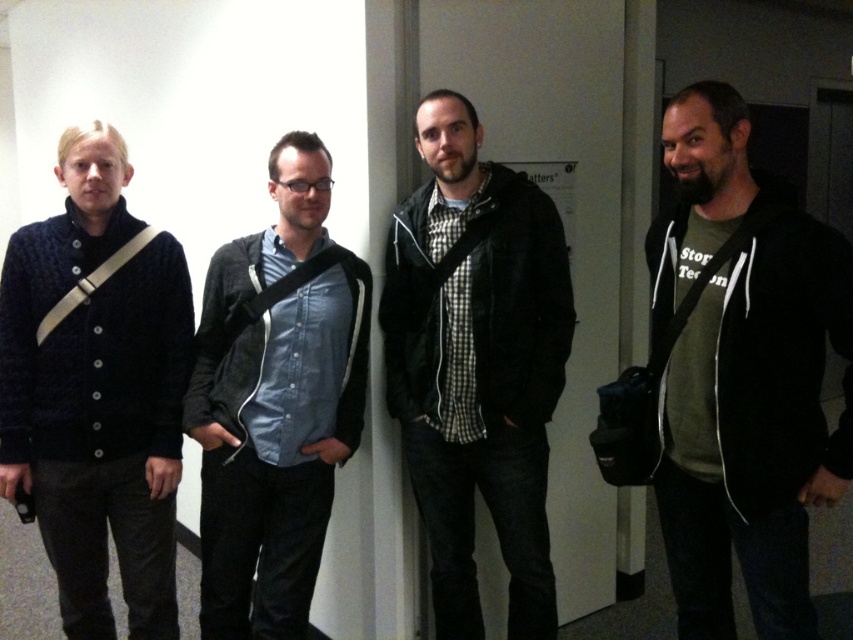
Question: Can you confirm if knitted dark blue sweater at left is positioned above checkered fabric shirt at center?

Choices:
 (A) no
 (B) yes

Answer: (A)

Question: Which object is closer to the camera taking this photo?

Choices:
 (A) dark green hoodie at right
 (B) knitted dark blue sweater at left

Answer: (A)

Question: Which point appears closest to the camera in this image?

Choices:
 (A) (20, 481)
 (B) (465, 310)
 (C) (805, 356)
 (D) (242, 273)

Answer: (C)

Question: Which object appears farthest from the camera in this image?

Choices:
 (A) knitted dark blue sweater at left
 (B) dark green hoodie at right
 (C) checkered fabric shirt at center

Answer: (C)

Question: In this image, where is dark green hoodie at right located relative to checkered fabric shirt at center?

Choices:
 (A) above
 (B) below

Answer: (B)

Question: Can you confirm if dark green hoodie at right is thinner than knitted dark blue sweater at left?

Choices:
 (A) yes
 (B) no

Answer: (B)